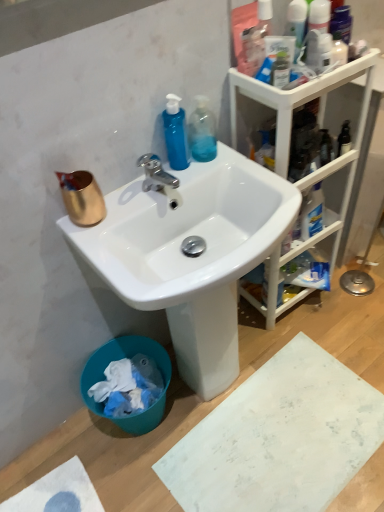
The image size is (384, 512). Identify the location of vacant space to the left of teal plastic trash bin at lower left. (74, 445).